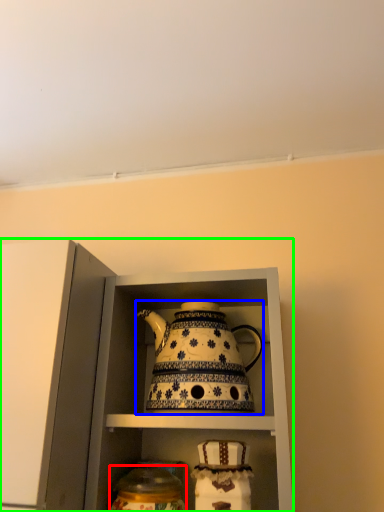
Question: Which object is the farthest from tableware (highlighted by a red box)? Choose among these: kettle (highlighted by a blue box) or cabinetry (highlighted by a green box).

Choices:
 (A) kettle
 (B) cabinetry

Answer: (B)